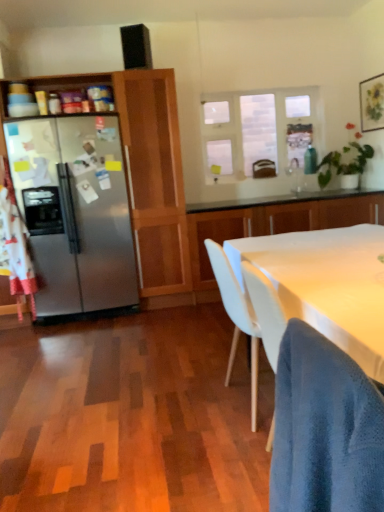
Question: In terms of height, does blue textured fabric chair at lower right look taller or shorter compared to satin silver refrigerator at left, marked as the 2th cabinetry in a right-to-left arrangement?

Choices:
 (A) short
 (B) tall

Answer: (A)

Question: Is point (307, 488) positioned closer to the camera than point (150, 234)?

Choices:
 (A) closer
 (B) farther

Answer: (A)

Question: Which object is the farthest from the satin silver refrigerator at left, positioned as the 1th cabinetry in left-to-right order?

Choices:
 (A) green leafy plant at upper right
 (B) blue textured fabric chair at lower right
 (C) clear glass window at upper center
 (D) white glossy cabinet at center, arranged as the first cabinetry when viewed from the right
 (E) white matte table at center

Answer: (B)

Question: Which of these objects is positioned farthest from the blue textured fabric chair at lower right?

Choices:
 (A) white matte table at center
 (B) green leafy plant at upper right
 (C) satin silver refrigerator at left, marked as the 2th cabinetry in a right-to-left arrangement
 (D) black matte speaker at upper center
 (E) clear glass window at upper center

Answer: (B)